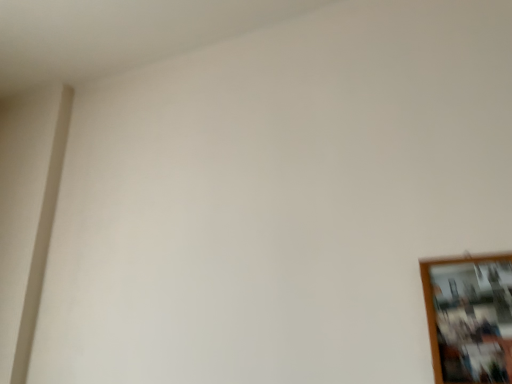
Identify the location of wooden picture frame at lower right. Image resolution: width=512 pixels, height=384 pixels. (470, 318).

Image resolution: width=512 pixels, height=384 pixels. What do you see at coordinates (470, 318) in the screenshot?
I see `wooden picture frame at lower right` at bounding box center [470, 318].

Identify the location of wooden picture frame at lower right. The height and width of the screenshot is (384, 512). (470, 318).